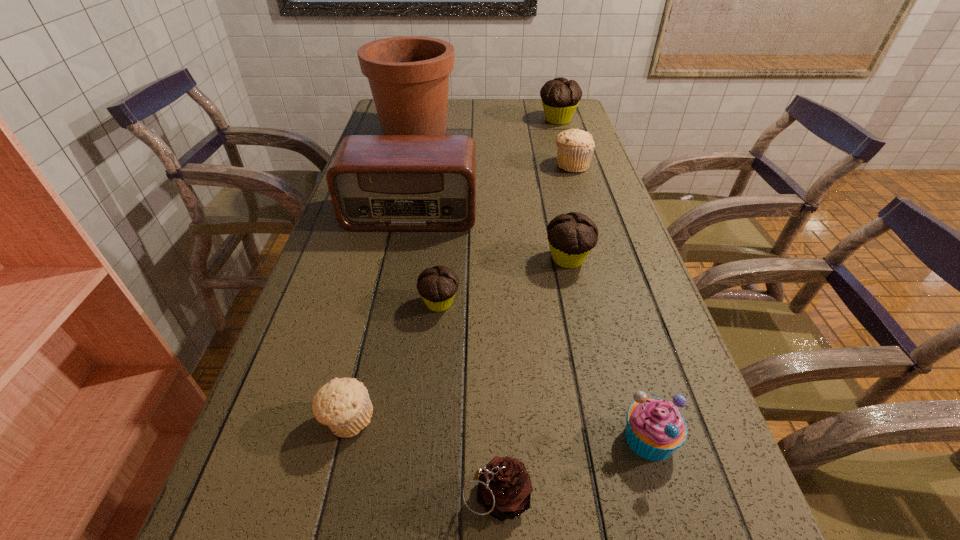
Find the location of a particular element. free space located on the front of the fourth nearest muffin is located at coordinates (595, 381).

Find the location of a particular element. The width and height of the screenshot is (960, 540). vacant region located 0.280m on the back of the blue muffin is located at coordinates (608, 295).

Identify the location of free point located with a leaf charm attached to the brown pinecone. 316,495.

Find the location of a particular element. The image size is (960, 540). vacant space located with a leaf charm attached to the brown pinecone is located at coordinates (396, 495).

Identify the location of vacant region located 0.260m with a leaf charm attached to the brown pinecone. This screenshot has height=540, width=960. (289, 495).

The width and height of the screenshot is (960, 540). In order to click on vacant area situated on the back of the left beige muffin in this screenshot , I will do `click(372, 320)`.

Find the location of `free space located on the back of the fourth farthest muffin`. free space located on the back of the fourth farthest muffin is located at coordinates (444, 262).

Find the location of a particular element. The image size is (960, 540). flowerpot present at the far edge is located at coordinates (408, 76).

The image size is (960, 540). In order to click on muffin at the far edge in this screenshot , I will do `click(560, 97)`.

Find the location of a particular element. flowerpot at the left edge is located at coordinates (408, 76).